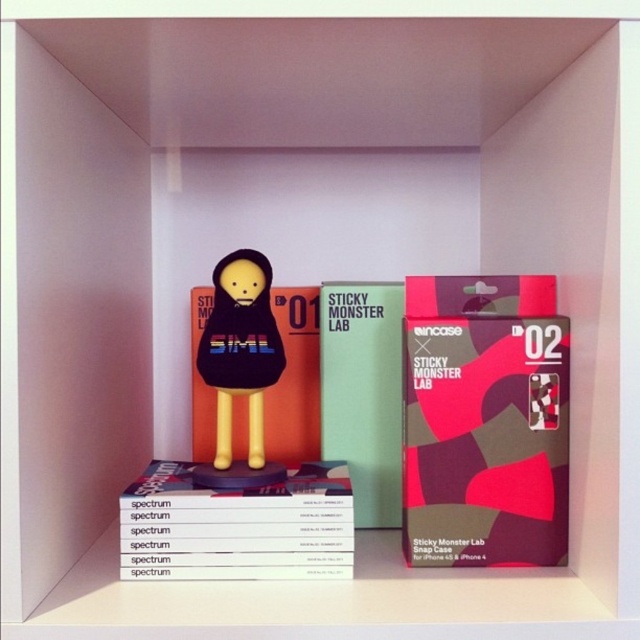
You are organizing a shelf and need to place a matte pink box at center and a matte black figure at center. According to the scene, where should you position the matte pink box relative to the matte black figure?

The matte pink box at center should be positioned below the matte black figure at center as per the scene description.

You are organizing a bookshelf and see the green matte book at center and the pink matte book at center. Which book should you place on the lower shelf if you want to follow the size order from largest to smallest?

You should place the pink matte book at center on the lower shelf because the green matte book at center is bigger and should be placed above it to follow the size order from largest to smallest.

In the scene shown: What is the spatial relationship between the green matte book at center and the matte black figure at center?

The green matte book at center is positioned on the right side of the matte black figure at center.